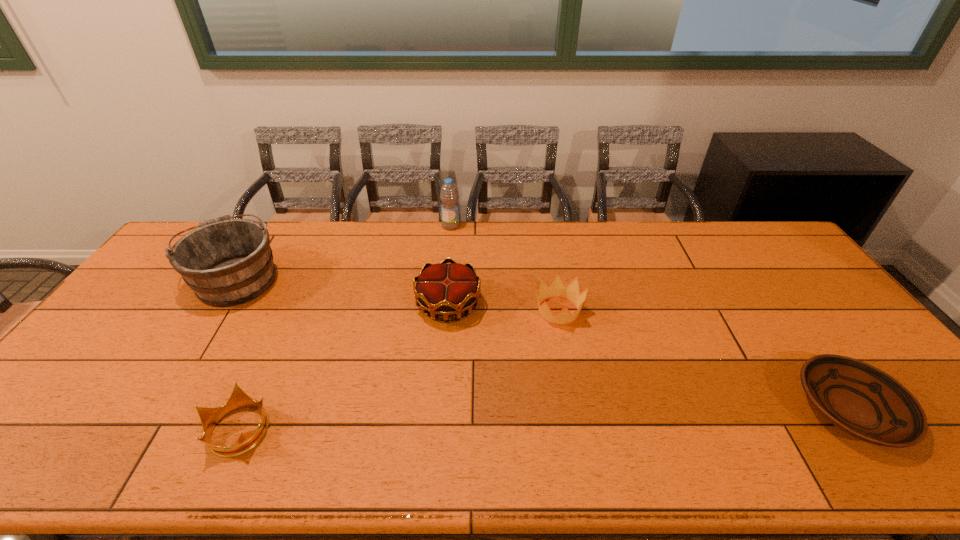
The height and width of the screenshot is (540, 960). Find the location of `object that is positioned at the far left corner`. object that is positioned at the far left corner is located at coordinates (226, 262).

At what (x,y) coordinates should I click in order to perform the action: click on object at the near right corner. Please return your answer as a coordinate pair (x, y). The width and height of the screenshot is (960, 540). Looking at the image, I should click on (860, 399).

What are the coordinates of `vacant space at the far edge` in the screenshot? It's located at (448, 231).

The height and width of the screenshot is (540, 960). What are the coordinates of `free space at the near edge of the desktop` in the screenshot? It's located at (266, 436).

The height and width of the screenshot is (540, 960). I want to click on vacant space at the left edge of the desktop, so click(x=92, y=341).

Locate an element on the screen. The width and height of the screenshot is (960, 540). blank space at the far right corner is located at coordinates (768, 261).

At what (x,y) coordinates should I click in order to perform the action: click on vacant region at the near right corner of the desktop. Please return your answer as a coordinate pair (x, y). The width and height of the screenshot is (960, 540). Looking at the image, I should click on (929, 458).

This screenshot has width=960, height=540. What are the coordinates of `vacant space that is in between the water bottle and the fifth object from left to right` in the screenshot? It's located at (504, 268).

The height and width of the screenshot is (540, 960). What are the coordinates of `vacant region between the second crown from right to left and the rightmost object` in the screenshot? It's located at (649, 357).

Image resolution: width=960 pixels, height=540 pixels. I want to click on vacant area between the second crown from left to right and the rightmost object, so click(x=649, y=357).